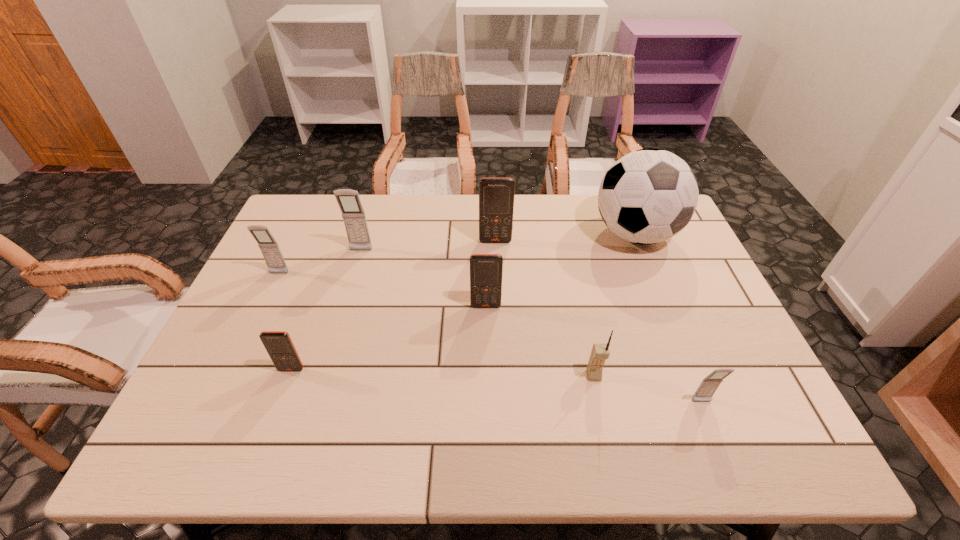
This screenshot has height=540, width=960. In order to click on vacant space positioned on the front of the second cellular telephone from right to left, where the keypad is located in this screenshot , I will do `click(609, 446)`.

Where is `free location located 0.080m on the screen of the sixth cellular telephone from right to left`? This screenshot has height=540, width=960. free location located 0.080m on the screen of the sixth cellular telephone from right to left is located at coordinates (279, 403).

Image resolution: width=960 pixels, height=540 pixels. I want to click on soccer ball located at the far edge, so [x=649, y=195].

You are a GUI agent. You are given a task and a screenshot of the screen. Output one action in this format:
    pyautogui.click(x=<x>, y=<y>)
    Task: Click on the cellular telephone at the far edge
    
    Given the screenshot: What is the action you would take?
    pyautogui.click(x=496, y=195)

Where is `object that is at the left edge`? The image size is (960, 540). object that is at the left edge is located at coordinates (271, 252).

At what (x,y) coordinates should I click in order to perform the action: click on soccer ball situated at the right edge. Please return your answer as a coordinate pair (x, y). Looking at the image, I should click on (649, 195).

Identify the location of cellular telephone present at the right edge. The image size is (960, 540). (708, 386).

Identify the location of object that is at the far right corner. This screenshot has width=960, height=540. (649, 195).

Where is `vacant space at the far edge of the desktop`? This screenshot has height=540, width=960. vacant space at the far edge of the desktop is located at coordinates (586, 235).

Find the location of a particular element. The height and width of the screenshot is (540, 960). vacant space at the near edge of the desktop is located at coordinates (704, 421).